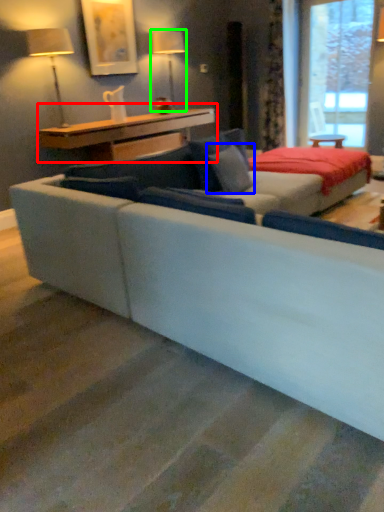
Question: Which is farther away from table (highlighted by a red box)? pillow (highlighted by a blue box) or table lamp (highlighted by a green box)?

Choices:
 (A) pillow
 (B) table lamp

Answer: (A)